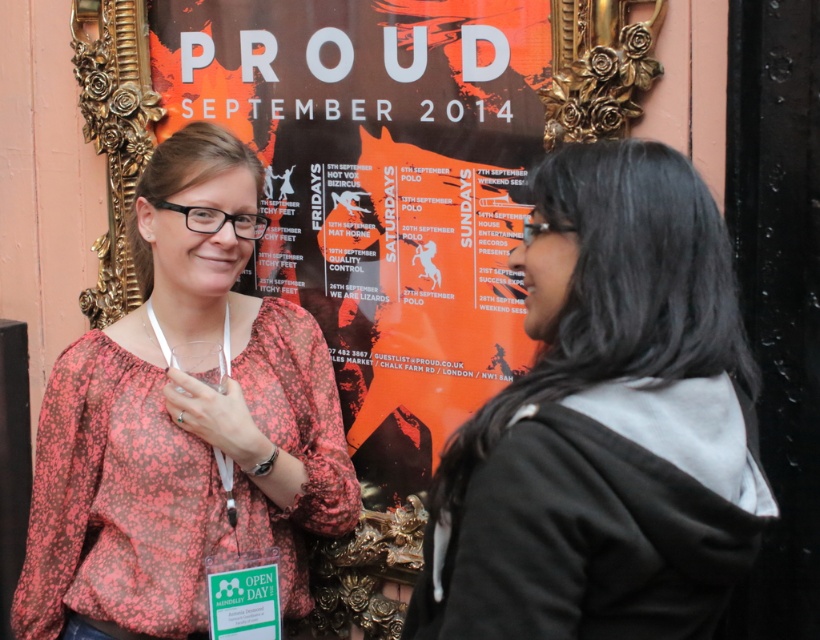
Can you confirm if black fabric jacket at center is shorter than floral print blouse at center?

Correct, black fabric jacket at center is not as tall as floral print blouse at center.

Is black fabric jacket at center closer to the viewer compared to floral print blouse at center?

Yes.

Identify the location of black fabric jacket at center. This screenshot has width=820, height=640. (598, 426).